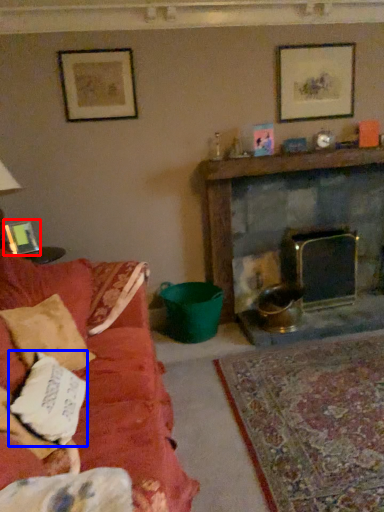
Question: Which of the following is the closest to the observer, picture frame (highlighted by a red box) or pillow (highlighted by a blue box)?

Choices:
 (A) picture frame
 (B) pillow

Answer: (B)